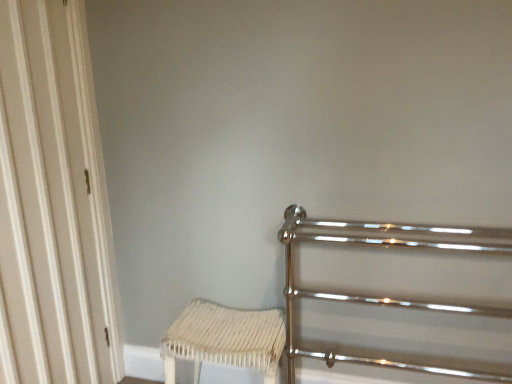
Question: From a real-world perspective, is white wood door at left positioned under white woven stool at lower center based on gravity?

Choices:
 (A) yes
 (B) no

Answer: (B)

Question: Is white wood door at left placed right next to white woven stool at lower center?

Choices:
 (A) yes
 (B) no

Answer: (B)

Question: Is white wood door at left outside white woven stool at lower center?

Choices:
 (A) no
 (B) yes

Answer: (B)

Question: Is white wood door at left positioned with its back to white woven stool at lower center?

Choices:
 (A) yes
 (B) no

Answer: (B)

Question: Does white wood door at left appear on the right side of white woven stool at lower center?

Choices:
 (A) yes
 (B) no

Answer: (B)

Question: Looking at their shapes, would you say white woven stool at lower center is wider or thinner than white wood door at left?

Choices:
 (A) wide
 (B) thin

Answer: (A)

Question: In the image, is white woven stool at lower center on the left side or the right side of white wood door at left?

Choices:
 (A) left
 (B) right

Answer: (B)

Question: Choose the correct answer: Is white woven stool at lower center inside white wood door at left or outside it?

Choices:
 (A) inside
 (B) outside

Answer: (B)

Question: Considering their positions, is white woven stool at lower center located in front of or behind white wood door at left?

Choices:
 (A) behind
 (B) front

Answer: (A)

Question: Considering the relative positions of white woven stool at lower center and polished chrome rail at right in the image provided, is white woven stool at lower center to the left or to the right of polished chrome rail at right?

Choices:
 (A) left
 (B) right

Answer: (A)

Question: From a real-world perspective, is white woven stool at lower center above or below polished chrome rail at right?

Choices:
 (A) below
 (B) above

Answer: (A)

Question: From the image's perspective, is white woven stool at lower center positioned above or below polished chrome rail at right?

Choices:
 (A) below
 (B) above

Answer: (A)

Question: Is white woven stool at lower center taller or shorter than polished chrome rail at right?

Choices:
 (A) short
 (B) tall

Answer: (A)

Question: Considering the positions of white wood door at left and white woven stool at lower center in the image, is white wood door at left taller or shorter than white woven stool at lower center?

Choices:
 (A) short
 (B) tall

Answer: (B)

Question: From the image's perspective, is white wood door at left positioned above or below white woven stool at lower center?

Choices:
 (A) below
 (B) above

Answer: (B)